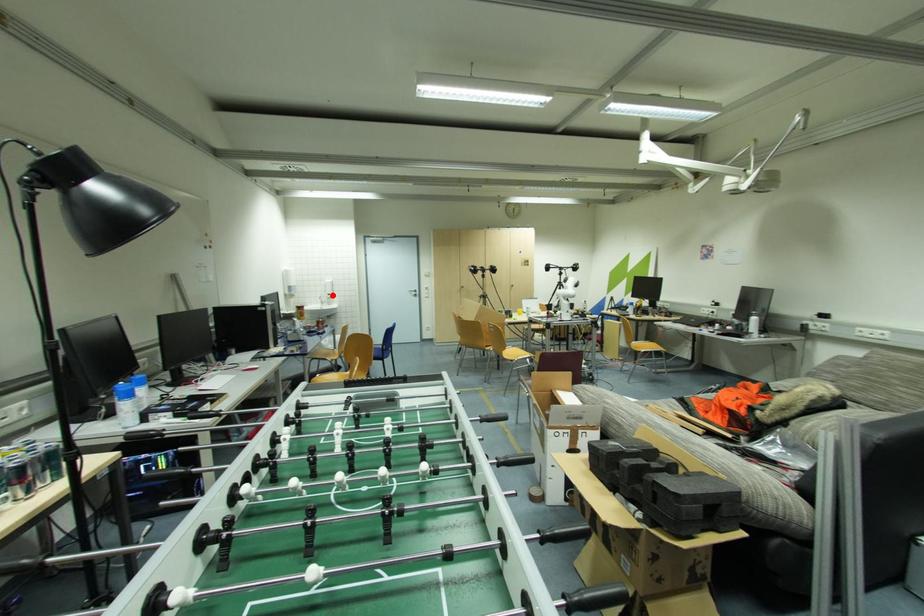
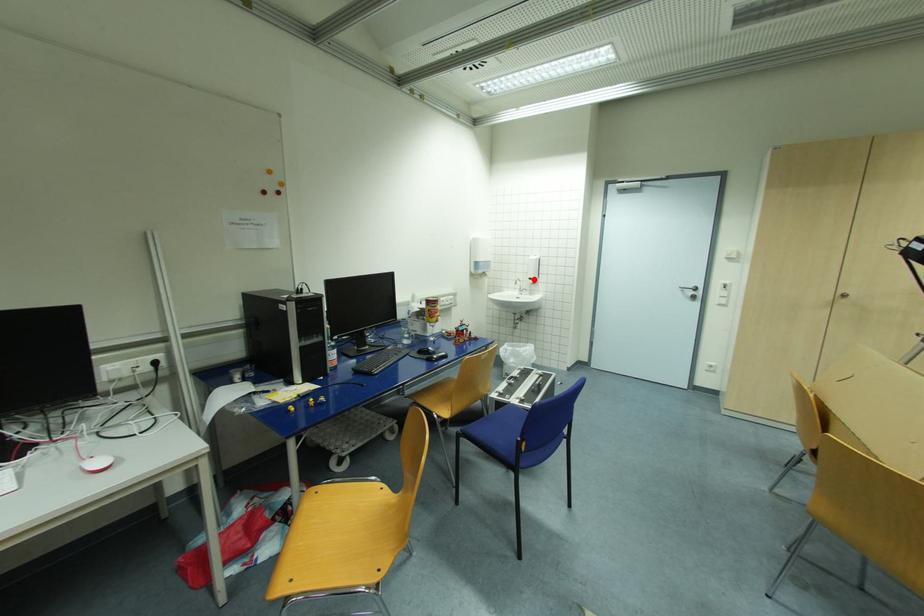
I am providing you with two images of the same scene from different viewpoints. A red point is marked on the first image and another point is marked on the second image. Does the point marked in image1 correspond to the same location as the one in image2?

Yes